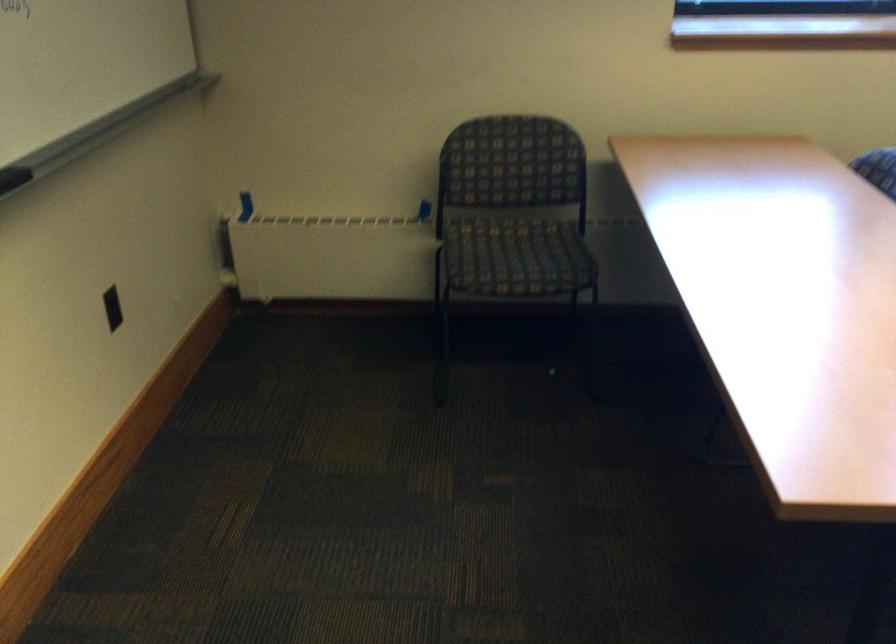
What do you see at coordinates (488, 220) in the screenshot? Image resolution: width=896 pixels, height=644 pixels. I see `a chair sitting surface` at bounding box center [488, 220].